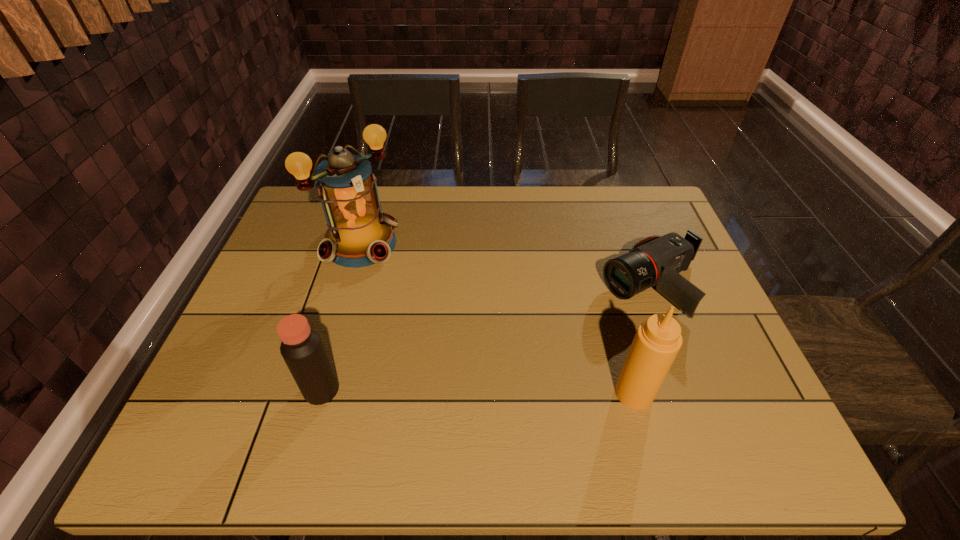
The image size is (960, 540). What are the coordinates of `vacant area that lies between the condiment and the second shortest object` in the screenshot? It's located at (478, 392).

You are a GUI agent. You are given a task and a screenshot of the screen. Output one action in this format:
    pyautogui.click(x=<x>, y=<y>)
    Task: Click on the free area in between the shortest object and the tallest object
    The height and width of the screenshot is (540, 960).
    Given the screenshot: What is the action you would take?
    pyautogui.click(x=507, y=265)

Locate which object is the third closest to the condiment. Please provide its 2D coordinates. Your answer should be formatted as a tuple, i.e. [(x, y)], where the tuple contains the x and y coordinates of a point satisfying the conditions above.

[(359, 234)]

In order to click on object that is the third closest to the camcorder in this screenshot , I will do `click(302, 349)`.

Image resolution: width=960 pixels, height=540 pixels. In order to click on free space that satisfies the following two spatial constraints: 1. on the back side of the camcorder; 2. on the right side of the condiment in this screenshot , I will do `click(605, 286)`.

You are a GUI agent. You are given a task and a screenshot of the screen. Output one action in this format:
    pyautogui.click(x=<x>, y=<y>)
    Task: Click on the blank space that satisfies the following two spatial constraints: 1. on the back side of the shortest object; 2. on the left side of the second shortest object
    This screenshot has height=540, width=960.
    Given the screenshot: What is the action you would take?
    pyautogui.click(x=351, y=286)

Locate an element on the screen. This screenshot has height=540, width=960. vacant point that satisfies the following two spatial constraints: 1. on the back side of the shortest object; 2. on the left side of the second shortest object is located at coordinates [x=351, y=286].

Where is `free space that satisfies the following two spatial constraints: 1. on the front side of the third tallest object; 2. on the left side of the condiment`? free space that satisfies the following two spatial constraints: 1. on the front side of the third tallest object; 2. on the left side of the condiment is located at coordinates (321, 393).

Find the location of a particular element. This screenshot has height=540, width=960. vacant position in the image that satisfies the following two spatial constraints: 1. on the front side of the condiment; 2. on the right side of the tallest object is located at coordinates (318, 393).